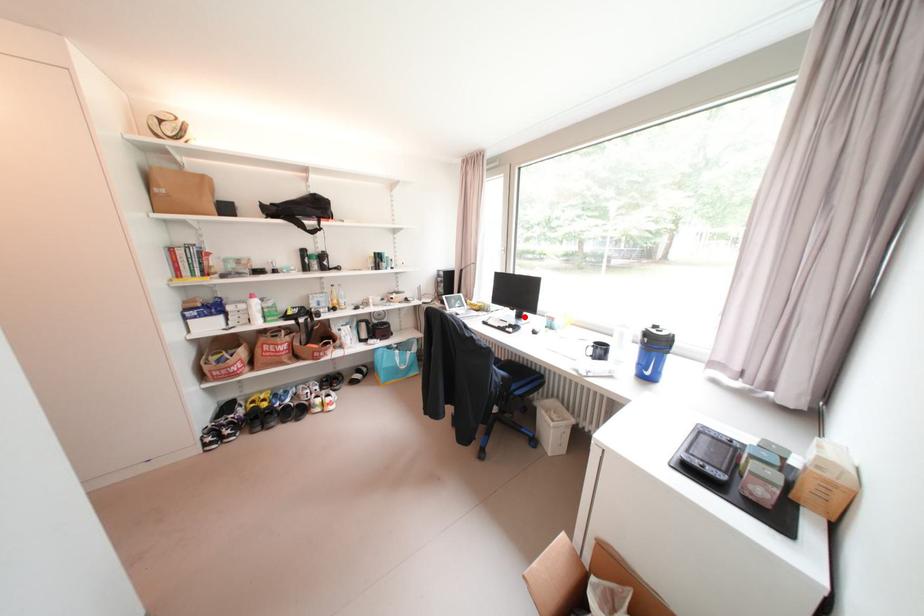
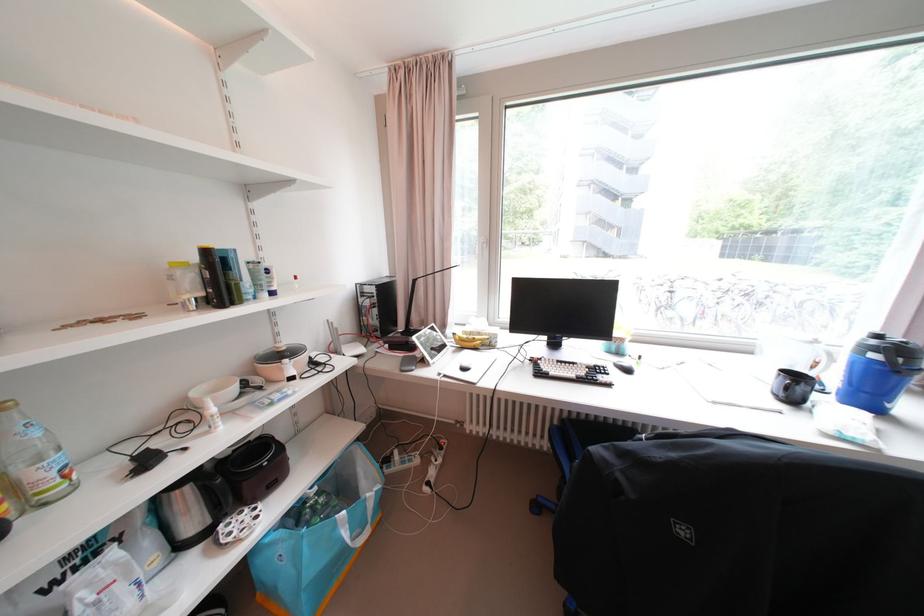
In the second image, find the point that corresponds to the highlighted location in the first image.

(555, 346)